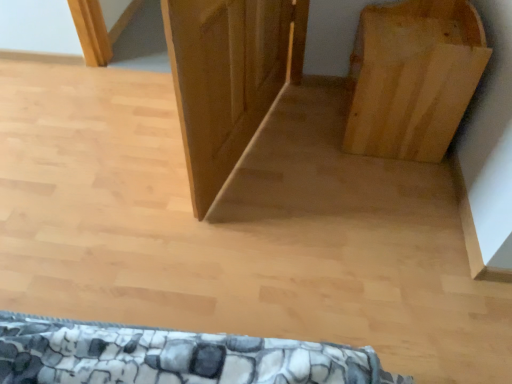
Question: Can you confirm if natural wood bookshelf at right is positioned to the right of wooden door at center?

Choices:
 (A) no
 (B) yes

Answer: (B)

Question: From a real-world perspective, is natural wood bookshelf at right positioned under wooden door at center based on gravity?

Choices:
 (A) yes
 (B) no

Answer: (A)

Question: Is natural wood bookshelf at right with wooden door at center?

Choices:
 (A) yes
 (B) no

Answer: (B)

Question: Is natural wood bookshelf at right aimed at wooden door at center?

Choices:
 (A) no
 (B) yes

Answer: (B)

Question: Is the position of natural wood bookshelf at right more distant than that of wooden door at center?

Choices:
 (A) yes
 (B) no

Answer: (A)

Question: Does natural wood bookshelf at right appear on the left side of wooden door at center?

Choices:
 (A) yes
 (B) no

Answer: (B)

Question: Does wooden door at center touch natural wood bookshelf at right?

Choices:
 (A) yes
 (B) no

Answer: (B)

Question: Does wooden door at center have a lesser width compared to natural wood bookshelf at right?

Choices:
 (A) yes
 (B) no

Answer: (A)

Question: Is wooden door at center behind natural wood bookshelf at right?

Choices:
 (A) yes
 (B) no

Answer: (B)

Question: Does wooden door at center have a smaller size compared to natural wood bookshelf at right?

Choices:
 (A) no
 (B) yes

Answer: (B)

Question: Can you confirm if wooden door at center is shorter than natural wood bookshelf at right?

Choices:
 (A) yes
 (B) no

Answer: (B)

Question: Considering the relative positions of wooden door at center and natural wood bookshelf at right in the image provided, is wooden door at center to the left of natural wood bookshelf at right from the viewer's perspective?

Choices:
 (A) yes
 (B) no

Answer: (A)

Question: Based on their positions, is wooden door at center located to the left or right of natural wood bookshelf at right?

Choices:
 (A) right
 (B) left

Answer: (B)